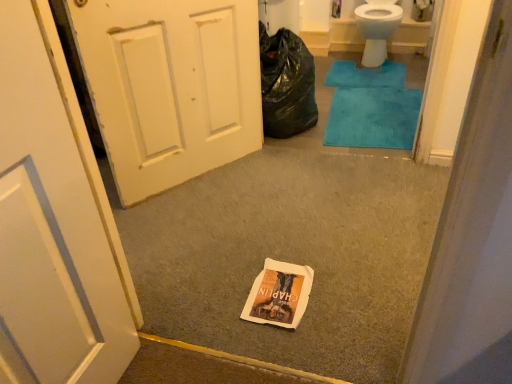
At what (x,y) coordinates should I click in order to perform the action: click on free space below white painted wood door at left (from a real-world perspective). Please return your answer as a coordinate pair (x, y). The height and width of the screenshot is (384, 512). Looking at the image, I should click on (196, 173).